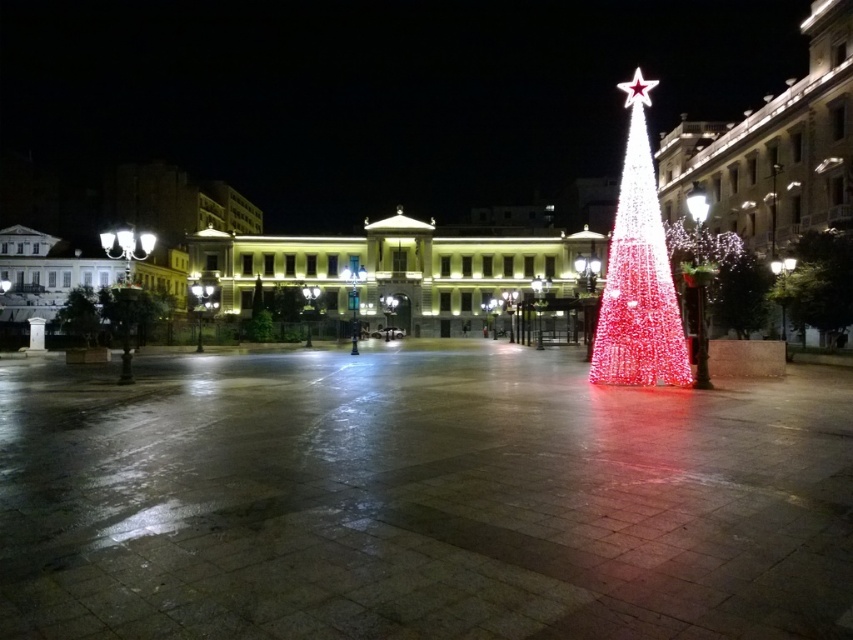
You are standing in the public square and want to take a photo of the illuminated plastic christmas tree at right. The camera you are using has a focal length of 50mm. If you want to capture the entire tree in your shot, which is positioned at point 0.442 on the horizontal axis and 0.960 on the vertical axis, what should you consider about the camera placement?

To capture the entire illuminated plastic christmas tree at right positioned at point 0.442 on the horizontal axis and 0.960 on the vertical axis, you should position the camera at a distance that ensures the tree fits within the camera frame, considering its height and the focal length of 50mm.

You are standing in the plaza and want to walk towards the grand building with columns. There are two points marked on the ground ahead of you at coordinates point (654, 307) and point (837, 305). Which point should you step on first to stay on the path leading directly to the building?

You should step on point (654, 307) first because it is in front of point (837, 305), so stepping on the closer point first will keep you on the path leading directly to the building.